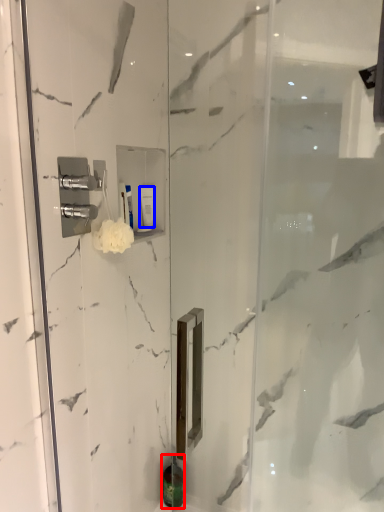
Question: Among these objects, which one is farthest to the camera, toiletry (highlighted by a red box) or toiletry (highlighted by a blue box)?

Choices:
 (A) toiletry
 (B) toiletry

Answer: (A)